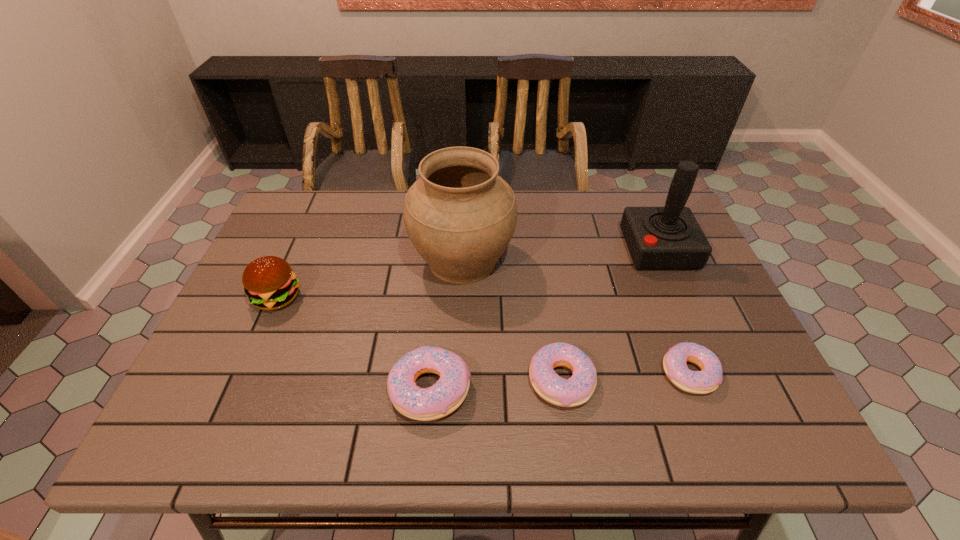
Locate an element on the screen. This screenshot has height=540, width=960. blank space located on the right of the fifth tallest object is located at coordinates (718, 381).

The height and width of the screenshot is (540, 960). In order to click on blank space located on the back of the shortest doughnut in this screenshot , I will do `click(671, 327)`.

Locate an element on the screen. vacant space located 0.240m on the base of the joystick is located at coordinates (542, 249).

The height and width of the screenshot is (540, 960). I want to click on free space located on the base of the joystick, so click(560, 249).

This screenshot has height=540, width=960. I want to click on vacant space located on the base of the joystick, so click(x=542, y=249).

At what (x,y) coordinates should I click in order to perform the action: click on vacant space located 0.130m on the front of the urn. Please return your answer as a coordinate pair (x, y). The image size is (960, 540). Looking at the image, I should click on (459, 339).

I want to click on free space located on the front of the hamburger, so click(261, 333).

Identify the location of joystick positioned at the far edge. This screenshot has width=960, height=540. (658, 238).

Where is `urn that is at the far edge`? The width and height of the screenshot is (960, 540). urn that is at the far edge is located at coordinates (460, 216).

I want to click on object that is at the left edge, so pos(269,282).